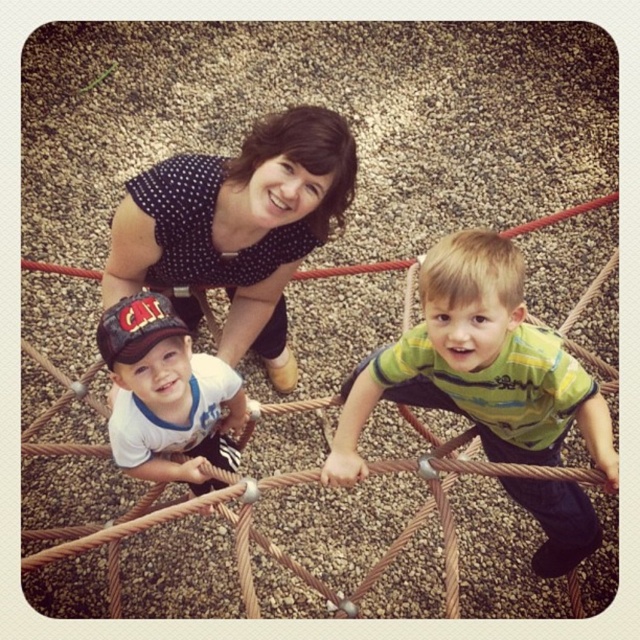
Question: Among these objects, which one is nearest to the camera?

Choices:
 (A) green striped shirt at center
 (B) brown rope bridge at center
 (C) polka dot fabric at upper center
 (D) matte black cap at center

Answer: (B)

Question: Based on their relative distances, which object is farther from the brown rope bridge at center?

Choices:
 (A) matte black cap at center
 (B) green striped shirt at center
 (C) polka dot fabric at upper center

Answer: (C)

Question: Considering the relative positions of green striped shirt at center and polka dot fabric at upper center in the image provided, where is green striped shirt at center located with respect to polka dot fabric at upper center?

Choices:
 (A) left
 (B) right

Answer: (B)

Question: Is brown rope bridge at center above matte black cap at center?

Choices:
 (A) yes
 (B) no

Answer: (B)

Question: Does green striped shirt at center have a larger size compared to polka dot fabric at upper center?

Choices:
 (A) yes
 (B) no

Answer: (A)

Question: Which of the following is the closest to the observer?

Choices:
 (A) green striped shirt at center
 (B) polka dot fabric at upper center
 (C) brown rope bridge at center

Answer: (C)